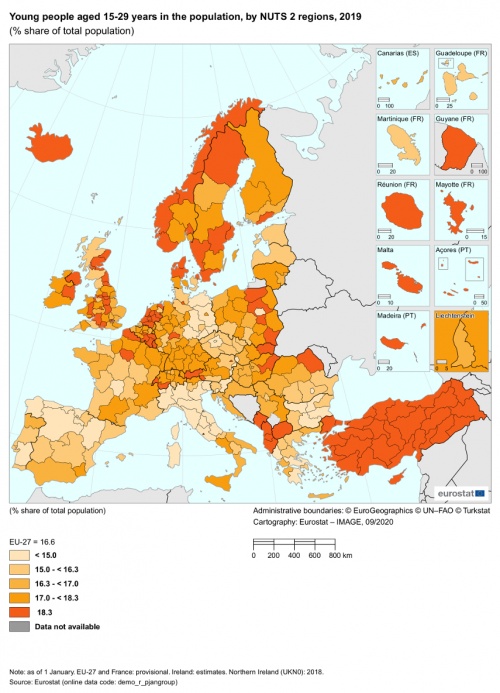
Image resolution: width=500 pixels, height=693 pixels. I want to click on map, so click(x=27, y=55), click(x=485, y=52), click(x=20, y=500), click(x=476, y=497).